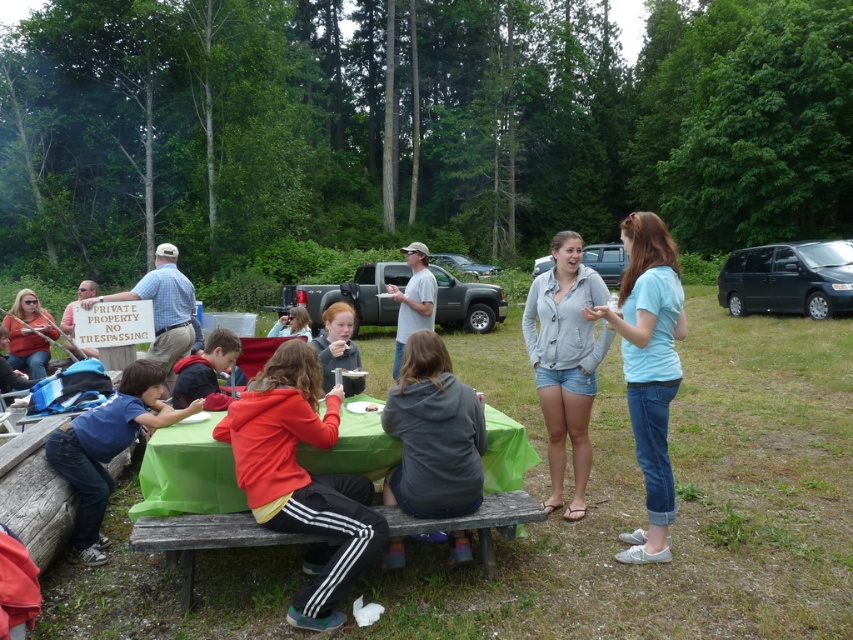
Which of these two, red hoodie at center or matte plastic cup at center, stands shorter?

Standing shorter between the two is red hoodie at center.

The height and width of the screenshot is (640, 853). Describe the element at coordinates (206, 371) in the screenshot. I see `red hoodie at center` at that location.

Locate an element on the screen. The height and width of the screenshot is (640, 853). red hoodie at center is located at coordinates (206, 371).

Is point (648, 321) positioned behind point (155, 252)?

No, it is not.

Does light blue cotton shirt at center have a lesser width compared to matte blue shirt at left?

Indeed, light blue cotton shirt at center has a lesser width compared to matte blue shirt at left.

This screenshot has height=640, width=853. I want to click on light blue cotton shirt at center, so click(648, 369).

Which is above, blue denim jeans at lower left or matte orange hoodie at left?

matte orange hoodie at left is higher up.

Which is more to the right, blue denim jeans at lower left or matte orange hoodie at left?

blue denim jeans at lower left is more to the right.

Does point (88, 422) come behind point (57, 332)?

No, it is not.

This screenshot has height=640, width=853. What are the coordinates of `blue denim jeans at lower left` in the screenshot? It's located at (107, 449).